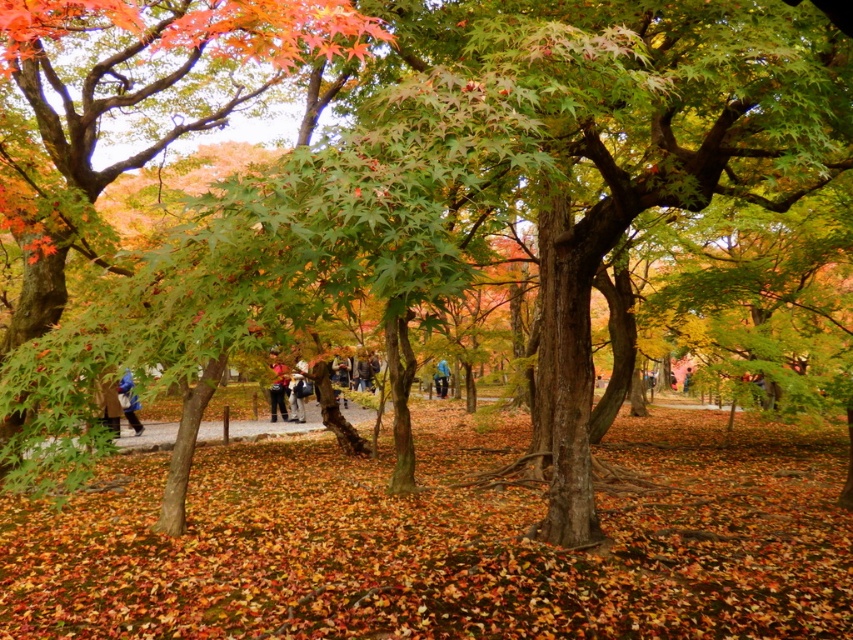
You are standing in the autumn scene described. You need to locate the blue fabric jacket at lower left. Where exactly is it positioned in terms of coordinates?

The blue fabric jacket at lower left is located at coordinates point (129,401).

You are a hiker who has lost your jacket in an autumn forest. You spot two blue fabric jackets in the scene. According to the image, which jacket is positioned higher up, the blue fabric jacket at lower left or the blue fabric jacket at center?

The blue fabric jacket at lower left is positioned higher up than the blue fabric jacket at center.